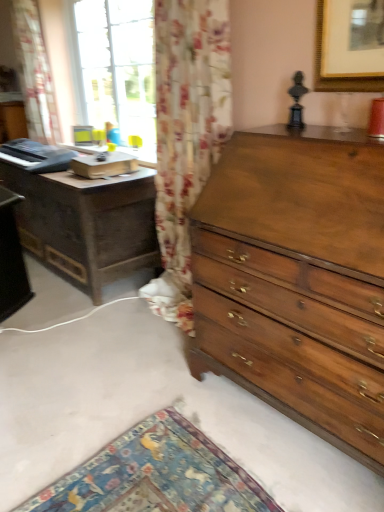
Find the location of a particular element. The width and height of the screenshot is (384, 512). free space in front of dark wood nightstand at left is located at coordinates (88, 340).